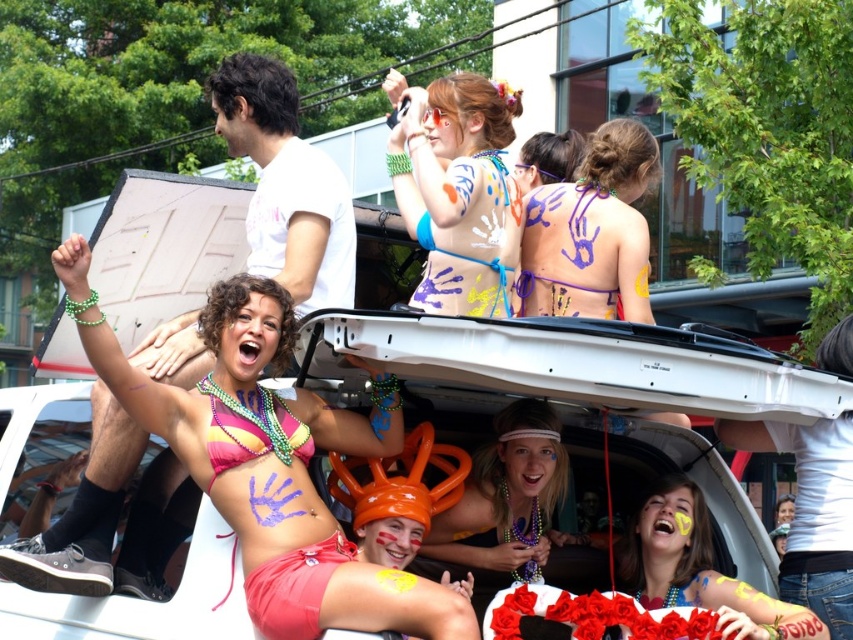
Does matte orange balloon at center come behind matte pink bikini at center?

No, it is in front of matte pink bikini at center.

Which is below, matte orange balloon at center or matte pink bikini at center?

matte pink bikini at center is below.

Who is more distant from viewer, (498, 529) or (685, 536)?

The point (498, 529) is more distant.

This screenshot has width=853, height=640. I want to click on matte orange balloon at center, so tap(505, 499).

Is point (282, 637) closer to viewer compared to point (618, 307)?

Yes.

Between point (288, 609) and point (630, 134), which one is positioned behind?

Point (630, 134)

Identify the location of pink matte bikini top at center. The height and width of the screenshot is (640, 853). (271, 464).

Which is more to the left, matte orange balloon at center or multicolored beaded bikini top at center?

Positioned to the left is multicolored beaded bikini top at center.

Which is above, matte orange balloon at center or multicolored beaded bikini top at center?

multicolored beaded bikini top at center is higher up.

You are a GUI agent. You are given a task and a screenshot of the screen. Output one action in this format:
    pyautogui.click(x=<x>, y=<y>)
    Task: Click on the matte orange balloon at center
    The width and height of the screenshot is (853, 640).
    Given the screenshot: What is the action you would take?
    pyautogui.click(x=505, y=499)